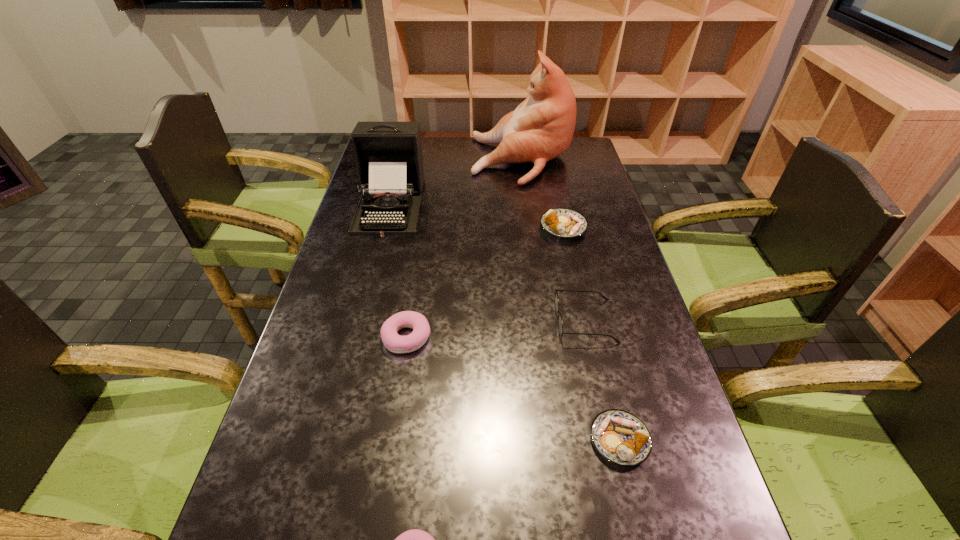
Find the location of `cat`. cat is located at coordinates (541, 128).

I want to click on orange cat, so tap(541, 128).

You are a GUI agent. You are given a task and a screenshot of the screen. Output one action in this format:
    pyautogui.click(x=<x>, y=<y>)
    Task: Click on the second tallest object
    
    Given the screenshot: What is the action you would take?
    [x=388, y=155]

Find the location of a particular element. This screenshot has height=540, width=960. the farther brown pastry is located at coordinates (565, 223).

Identify the location of the bigger brown pastry. (565, 223).

This screenshot has width=960, height=540. I want to click on spectacles, so click(560, 323).

Find the location of a particular element. the bigger pink pastry is located at coordinates (395, 343).

Locate an element on the screen. This screenshot has height=540, width=960. the third nearest pastry is located at coordinates (395, 343).

The height and width of the screenshot is (540, 960). What are the coordinates of `the third farthest pastry` in the screenshot? It's located at (620, 437).

This screenshot has height=540, width=960. Find the location of `the smaller brown pastry`. the smaller brown pastry is located at coordinates (620, 437).